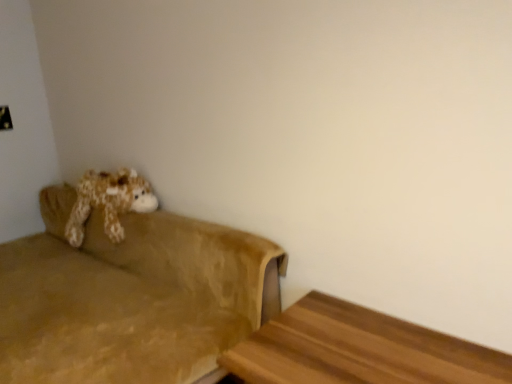
Find the location of `empty space that is ontop of wooden table at lower right (from a real-world perspective)`. empty space that is ontop of wooden table at lower right (from a real-world perspective) is located at coordinates (356, 351).